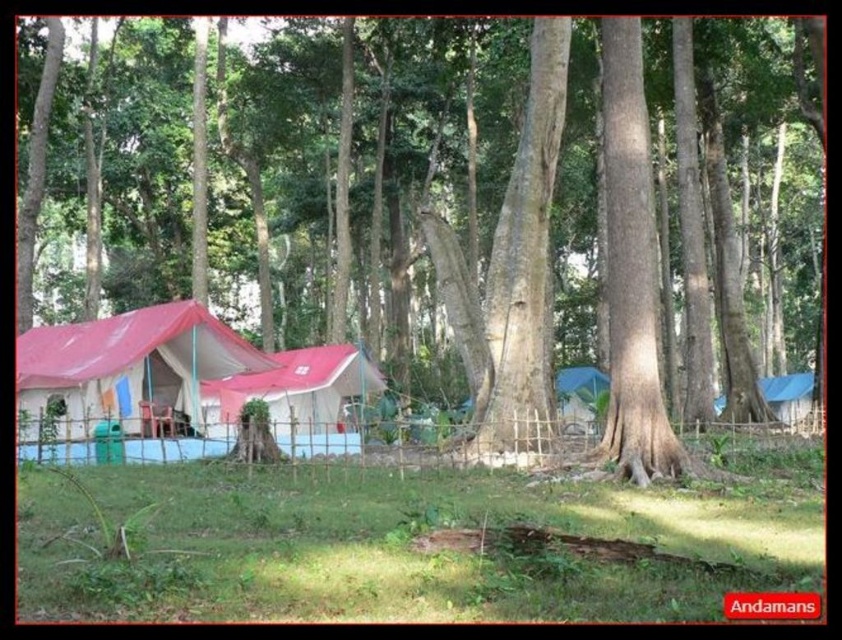
You are setting up a camera on a tripod in the campsite. You want to take a photo of the matte red tent at lower left without the smooth bark tree at center blocking it. Where should you position the camera relative to the tents?

To avoid the smooth bark tree at center blocking the matte red tent at lower left, position the camera behind the matte red tent at lower left so that the tree is no longer in front of it.

You are planning to set up a new tent in the campsite. The smooth bark tree at center is in the way. Can you place your new tent closer to the matte red tent at lower left without hitting the tree?

The smooth bark tree at center is taller than the matte red tent at lower left, so placing the new tent closer to the matte red tent at lower left would avoid hitting the tree since the tree is taller and likely occupies more vertical space, but the horizontal distance between them isn

You are planning to set up a new tent in the campsite. The smooth bark tree at center and the matte red tent at center are both in the way. Which one should you move to make space?

The smooth bark tree at center has a larger size compared to the matte red tent at center, so you should move the matte red tent at center to make space since it is smaller and easier to relocate.